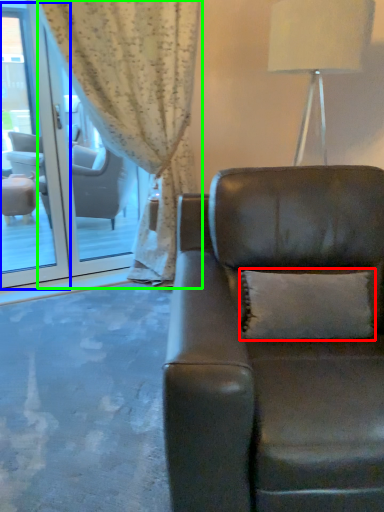
Question: Which object is the farthest from pillow (highlighted by a red box)? Choose among these: screen door (highlighted by a blue box) or curtain (highlighted by a green box).

Choices:
 (A) screen door
 (B) curtain

Answer: (A)